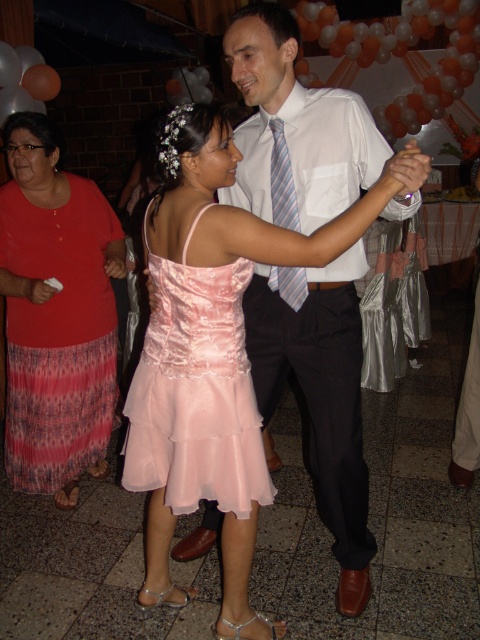
Question: Is white shirt at center positioned at the back of white smooth dress shirt at center?

Choices:
 (A) no
 (B) yes

Answer: (A)

Question: Is pink pleated skirt at lower left thinner than pink satin dress at center?

Choices:
 (A) no
 (B) yes

Answer: (A)

Question: Is white shirt at center in front of white smooth dress shirt at center?

Choices:
 (A) yes
 (B) no

Answer: (A)

Question: Among these points, which one is nearest to the camera?

Choices:
 (A) (101, 321)
 (B) (269, 3)

Answer: (B)

Question: Considering the real-world distances, which object is closest to the white smooth dress shirt at center?

Choices:
 (A) white shirt at center
 (B) pink satin dress at center
 (C) pink pleated skirt at lower left
 (D) striped fabric tie at center

Answer: (A)

Question: Which point is farther to the camera?

Choices:
 (A) white shirt at center
 (B) white smooth dress shirt at center
 (C) pink satin dress at center

Answer: (B)